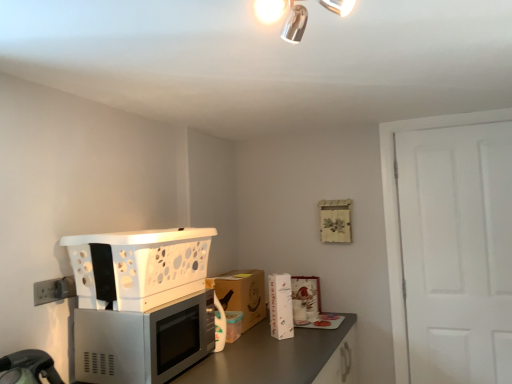
What do you see at coordinates (307, 294) in the screenshot? This screenshot has height=384, width=512. I see `matte white picture frame at center, positioned as the 1th appliance in right-to-left order` at bounding box center [307, 294].

This screenshot has height=384, width=512. I want to click on metallic gray countertop at lower center, so click(270, 356).

Measure the distance between point (186, 275) and camera.

Point (186, 275) and camera are 6.14 feet apart from each other.

What do you see at coordinates (138, 266) in the screenshot? I see `white plastic basket at left` at bounding box center [138, 266].

The height and width of the screenshot is (384, 512). What do you see at coordinates (144, 341) in the screenshot?
I see `satin silver microwave at lower left` at bounding box center [144, 341].

What do you see at coordinates (280, 306) in the screenshot? I see `white glossy refrigerator at center, marked as the first appliance in a front-to-back arrangement` at bounding box center [280, 306].

This screenshot has height=384, width=512. I want to click on matte white picture frame at center, which is the 2th appliance from left to right, so click(307, 294).

Is white plastic electric outlet at lower left facing away from white plastic basket at left?

white plastic electric outlet at lower left does not have its back to white plastic basket at left.

Is white plastic electric outlet at lower left completely or partially outside of white plastic basket at left?

Absolutely, white plastic electric outlet at lower left is external to white plastic basket at left.

This screenshot has height=384, width=512. In the image, there is a white plastic basket at left. What are the coordinates of `electric outlet below it (from the image's perspective)` in the screenshot? It's located at (54, 290).

Can you confirm if white plastic electric outlet at lower left is thinner than white plastic basket at left?

Correct, the width of white plastic electric outlet at lower left is less than that of white plastic basket at left.

Considering the sizes of objects white matte door at right and brown cardboard box at center in the image provided, who is bigger, white matte door at right or brown cardboard box at center?

white matte door at right is bigger.

Is white matte door at right positioned beyond the bounds of brown cardboard box at center?

white matte door at right is positioned outside brown cardboard box at center.

Does white matte door at right have a lesser height compared to brown cardboard box at center?

No, white matte door at right is not shorter than brown cardboard box at center.

Based on the photo, from the image's perspective, which is above, white matte door at right or brown cardboard box at center?

white matte door at right.

Who is taller, white glossy refrigerator at center, marked as the first appliance in a front-to-back arrangement, or white plastic basket at left?

With more height is white glossy refrigerator at center, marked as the first appliance in a front-to-back arrangement.

Based on the photo, between white glossy refrigerator at center, which ranks as the 1th appliance in left-to-right order, and white plastic basket at left, which one has larger width?

white plastic basket at left.

Is white glossy refrigerator at center, arranged as the second appliance when viewed from the right, oriented towards white plastic basket at left?

No, white glossy refrigerator at center, arranged as the second appliance when viewed from the right, is not facing towards white plastic basket at left.

From a real-world perspective, which is physically below, white plastic basket at left or satin silver microwave at lower left?

From a 3D spatial view, satin silver microwave at lower left is below.

Is white plastic basket at left turned away from satin silver microwave at lower left?

No, white plastic basket at left's orientation is not away from satin silver microwave at lower left.

Can we say white plastic basket at left lies outside satin silver microwave at lower left?

Yes.

Locate an element on the screen. cabinetry located underneath the white plastic basket at left (from a real-world perspective) is located at coordinates (243, 294).

Is brown cardboard box at center in front of or behind white plastic basket at left in the image?

brown cardboard box at center is positioned farther from the viewer than white plastic basket at left.

Does white plastic electric outlet at lower left lie behind metallic chrome light fixture at upper center?

Yes, it is.

Considering the points (42, 282) and (342, 1), which point is in front, point (42, 282) or point (342, 1)?

The point (342, 1) is closer.

From the picture: Are white plastic electric outlet at lower left and metallic chrome light fixture at upper center beside each other?

No.

At what (x,y) coordinates should I click in order to perform the action: click on light fixture on the right of white plastic electric outlet at lower left. Please return your answer as a coordinate pair (x, y). This screenshot has height=384, width=512. Looking at the image, I should click on (287, 18).

Is brown cardboard box at center positioned before white plastic electric outlet at lower left?

No, the depth of brown cardboard box at center is greater than that of white plastic electric outlet at lower left.

Between point (251, 326) and point (48, 296), which one is positioned behind?

The point (251, 326) is behind.

In terms of height, does brown cardboard box at center look taller or shorter compared to white plastic electric outlet at lower left?

Considering their sizes, brown cardboard box at center has more height than white plastic electric outlet at lower left.

In the image, there is a white plastic electric outlet at lower left. At what (x,y) coordinates should I click in order to perform the action: click on kitchen appliance above it (from the image's perspective). Please return your answer as a coordinate pair (x, y). Looking at the image, I should click on (138, 266).

Identify the location of door on the right of the brown cardboard box at center. (457, 251).

Based on their spatial positions, is white plastic electric outlet at lower left or white plastic basket at left closer to metallic chrome light fixture at upper center?

white plastic basket at left.

From the image, which object appears to be farther from white glossy refrigerator at center, which ranks as the 1th appliance in left-to-right order, white plastic electric outlet at lower left or metallic chrome light fixture at upper center?

metallic chrome light fixture at upper center is further to white glossy refrigerator at center, which ranks as the 1th appliance in left-to-right order.

Which object lies nearer to the anchor point matte white picture frame at center, which is the 2th appliance from left to right, brown cardboard box at center or metallic gray countertop at lower center?

brown cardboard box at center.

Estimate the real-world distances between objects in this image. Which object is further from satin silver microwave at lower left, metallic gray countertop at lower center or white glossy refrigerator at center, arranged as the second appliance when viewed from the right?

white glossy refrigerator at center, arranged as the second appliance when viewed from the right, is further to satin silver microwave at lower left.

Considering their positions, is metallic gray countertop at lower center positioned closer to metallic chrome light fixture at upper center than white plastic basket at left?

white plastic basket at left lies closer to metallic chrome light fixture at upper center than the other object.

From the image, which object appears to be nearer to satin silver microwave at lower left, white glossy refrigerator at center, which is counted as the 2th appliance, starting from the back, or white plastic basket at left?

The object closer to satin silver microwave at lower left is white plastic basket at left.

Estimate the real-world distances between objects in this image. Which object is further from metallic gray countertop at lower center, white plastic basket at left or metallic chrome light fixture at upper center?

metallic chrome light fixture at upper center.

Which object lies nearer to the anchor point white glossy refrigerator at center, marked as the first appliance in a front-to-back arrangement, satin silver microwave at lower left or white plastic basket at left?

The object closer to white glossy refrigerator at center, marked as the first appliance in a front-to-back arrangement, is satin silver microwave at lower left.

I want to click on appliance positioned between satin silver microwave at lower left and matte white picture frame at center, marked as the 2th appliance in a front-to-back arrangement, from near to far, so click(x=280, y=306).

The height and width of the screenshot is (384, 512). I want to click on electric outlet between metallic chrome light fixture at upper center and metallic gray countertop at lower center in the vertical direction, so click(54, 290).

Locate an element on the screen. kitchen appliance between metallic chrome light fixture at upper center and metallic gray countertop at lower center in the vertical direction is located at coordinates (138, 266).

This screenshot has width=512, height=384. What are the coordinates of `light fixture situated between white plastic basket at left and white matte door at right from left to right` in the screenshot? It's located at click(x=287, y=18).